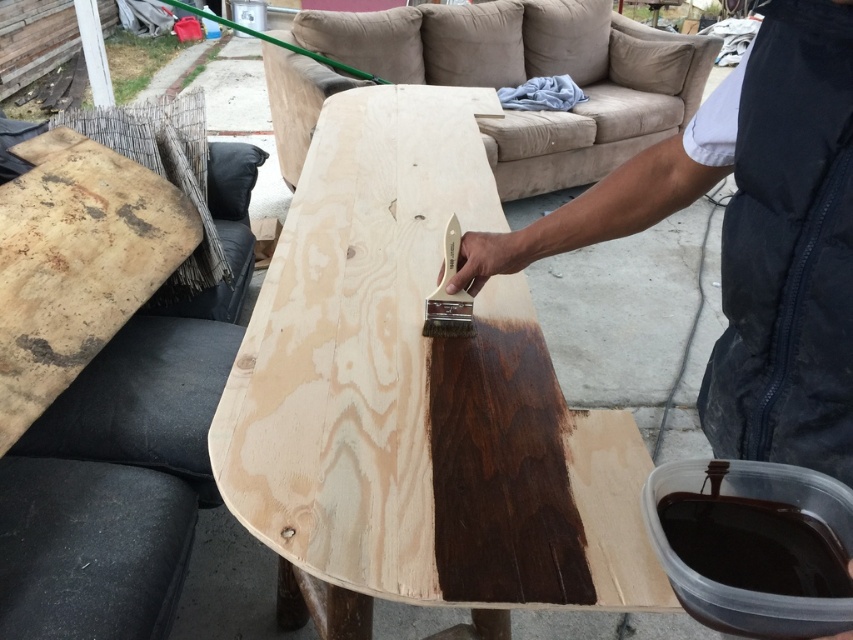
You are a carpenter working on a project and need to choose between the stained wood table at center and the dark brown wood plank at center. If you need a wider piece of wood for your project, which one should you choose?

The stained wood table at center has a larger width than the dark brown wood plank at center, so you should choose the stained wood table at center for your project.